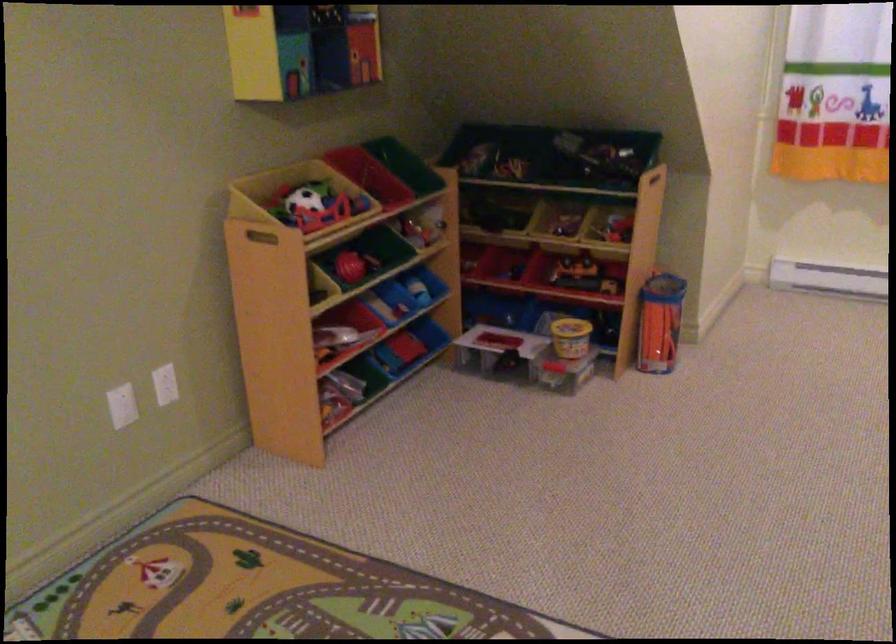
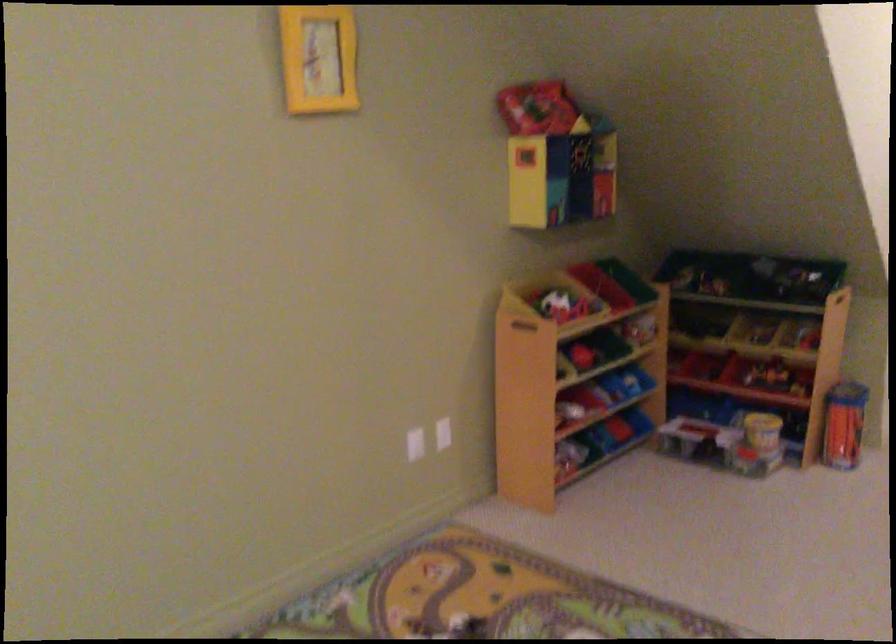
Find the pixel in the second image that matches pixel 642 187 in the first image.

(839, 303)